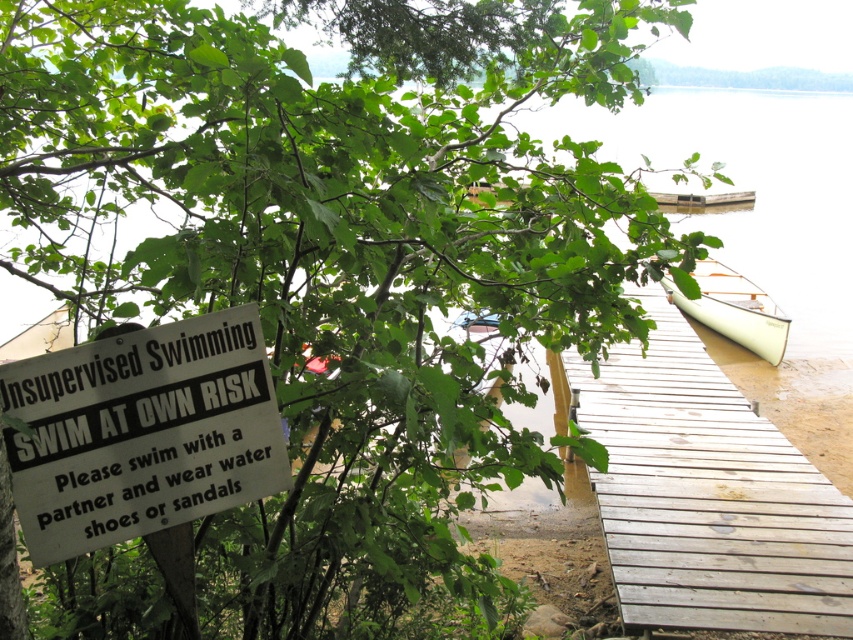
Question: Which point appears farthest from the camera in this image?

Choices:
 (A) (618, 140)
 (B) (25, 452)
 (C) (648, 372)

Answer: (A)

Question: From the image, what is the correct spatial relationship of white paper sign at left in relation to clear water at center?

Choices:
 (A) right
 (B) left

Answer: (B)

Question: Can you confirm if clear water at center is wider than white matte boat at right?

Choices:
 (A) yes
 (B) no

Answer: (B)

Question: Which object is farther from the camera taking this photo?

Choices:
 (A) wooden dock at center
 (B) clear water at center

Answer: (B)

Question: Estimate the real-world distances between objects in this image. Which object is farther from the white matte boat at right?

Choices:
 (A) white paper sign at left
 (B) wooden dock at center

Answer: (A)

Question: Does clear water at center appear on the left side of white matte boat at right?

Choices:
 (A) no
 (B) yes

Answer: (A)